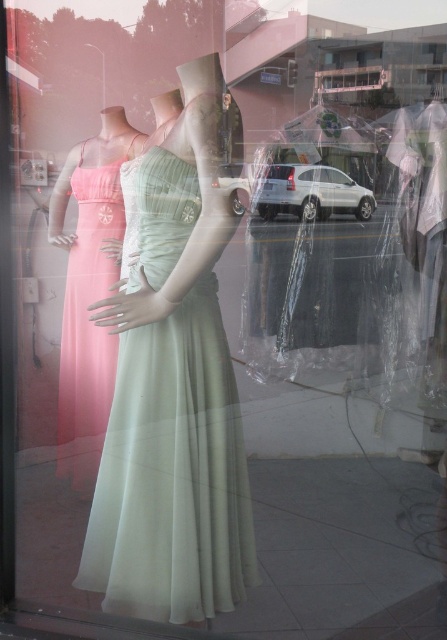
You are a customer looking at the storefront window display. You want to know which dress is closer to you. The dresses are the satin pale green dress at center and the matte pink fabric dress at left. Which one is closer?

The satin pale green dress at center is closer because it is positioned under the matte pink fabric dress at left, meaning it is in front.

You are standing in front of the storefront window display. There are two points marked on the display. The first point is at coordinates point (211, 518) and the second point is at point (92, 324). Which point is closer to you?

Point (211, 518) is closer to the camera than point (92, 324).

You are a customer looking at the storefront window display. You see a point marked at coordinates [172,474]. Which dress is this point located on?

The point at [172,474] is located on the satin pale green dress at center.